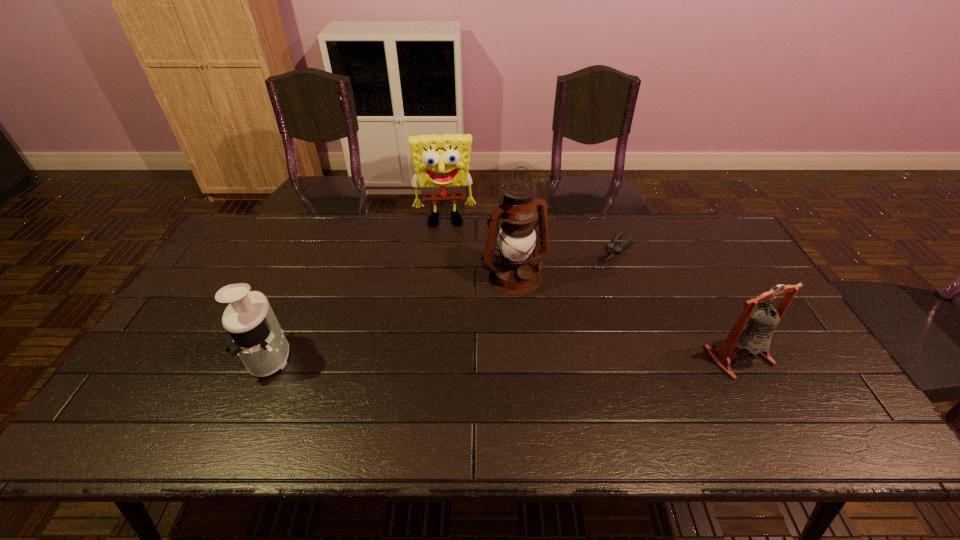
Locate an element on the screen. This screenshot has width=960, height=540. the third closest object to the farthest object is located at coordinates (258, 339).

The width and height of the screenshot is (960, 540). In order to click on free space in the image that satisfies the following two spatial constraints: 1. on the front side of the farthest object; 2. on the left side of the pliers in this screenshot , I will do `click(443, 248)`.

Where is `vacant point that satisfies the following two spatial constraints: 1. on the back side of the juicer; 2. on the right side of the fourth object from left to right`? vacant point that satisfies the following two spatial constraints: 1. on the back side of the juicer; 2. on the right side of the fourth object from left to right is located at coordinates (318, 248).

Identify the location of free location that satisfies the following two spatial constraints: 1. on the front side of the rightmost object; 2. on the left side of the tallest object. (521, 356).